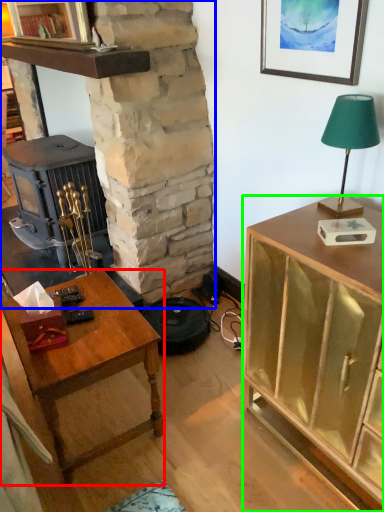
Question: Which object is the farthest from desk (highlighted by a red box)? Choose among these: fireplace (highlighted by a blue box) or cabinetry (highlighted by a green box).

Choices:
 (A) fireplace
 (B) cabinetry

Answer: (A)